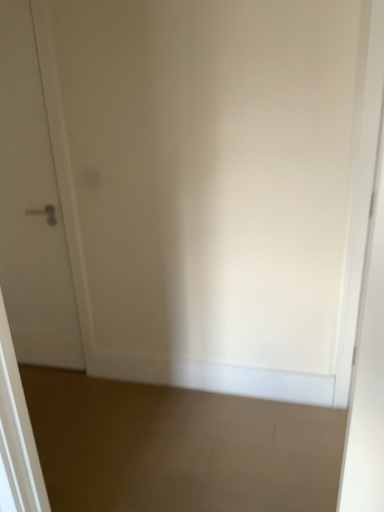
What is the approximate width of white matte door at left?

white matte door at left is 2.50 inches wide.

The width and height of the screenshot is (384, 512). Find the location of `white matte door at left`. white matte door at left is located at coordinates (32, 208).

What do you see at coordinates (32, 208) in the screenshot?
I see `white matte door at left` at bounding box center [32, 208].

Where is `white matte door at left`? This screenshot has height=512, width=384. white matte door at left is located at coordinates (32, 208).